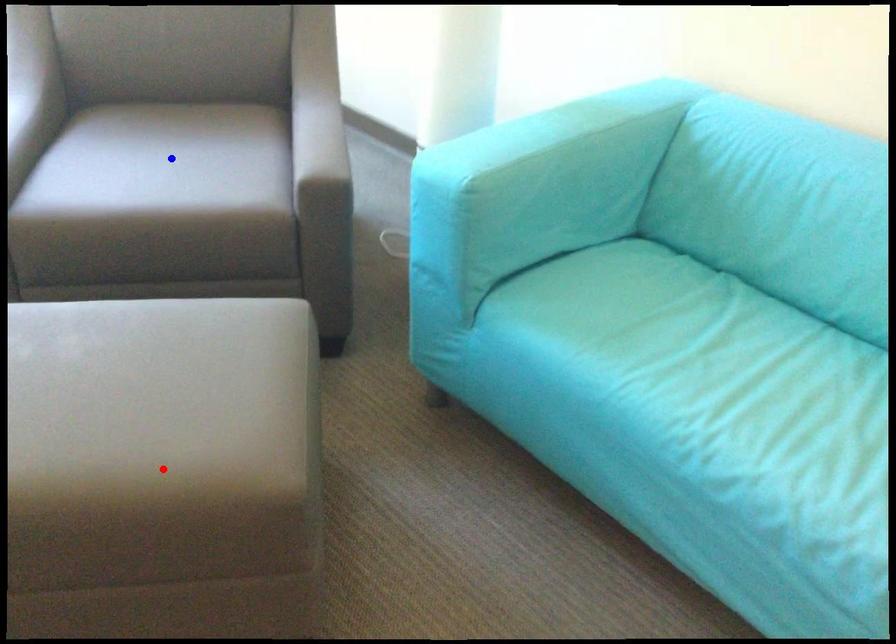
Question: Which of the two points in the image is closer to the camera?

Choices:
 (A) Blue point is closer.
 (B) Red point is closer.

Answer: (B)